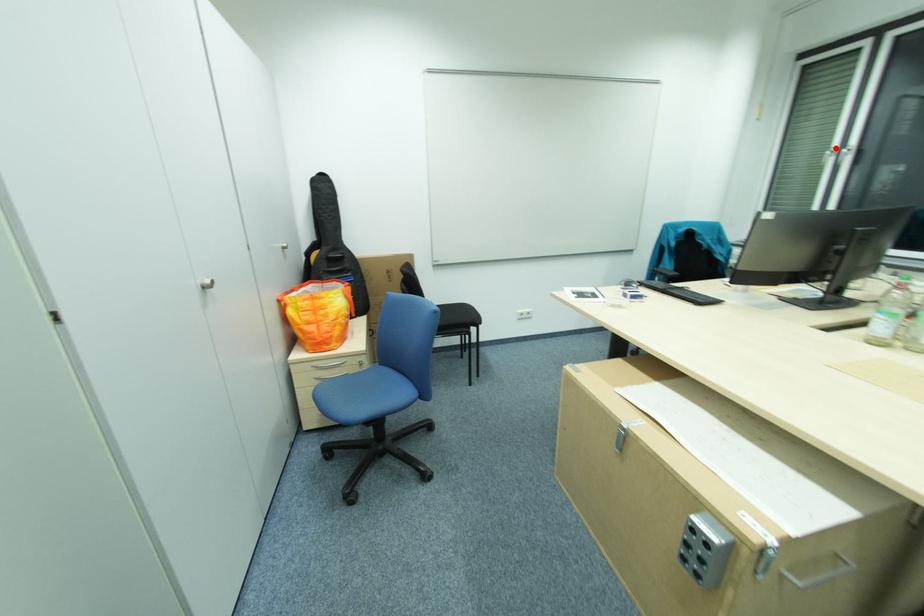
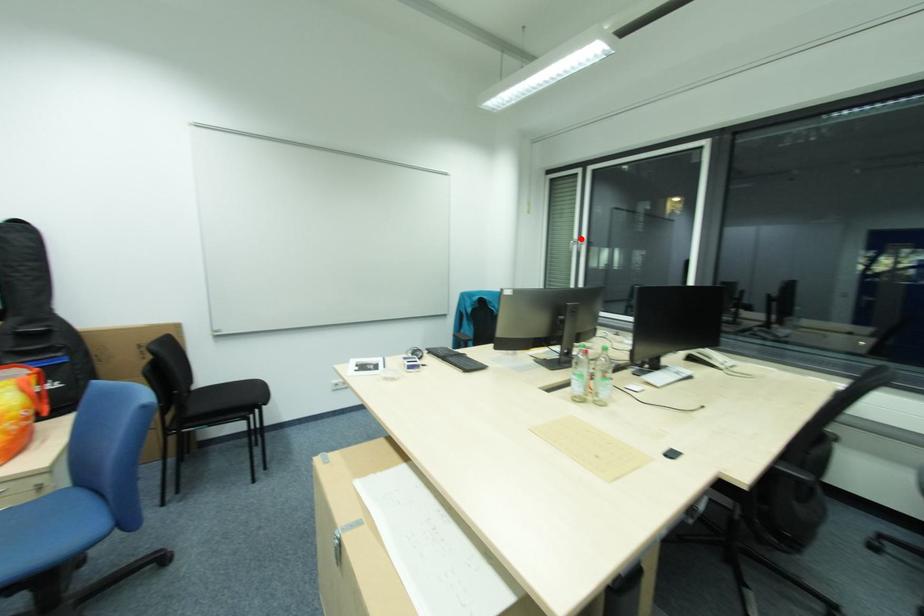
I am providing you with two images of the same scene from different viewpoints. A red point is marked on the first image and another point is marked on the second image. Is the marked point in image1 the same physical position as the marked point in image2?

Yes